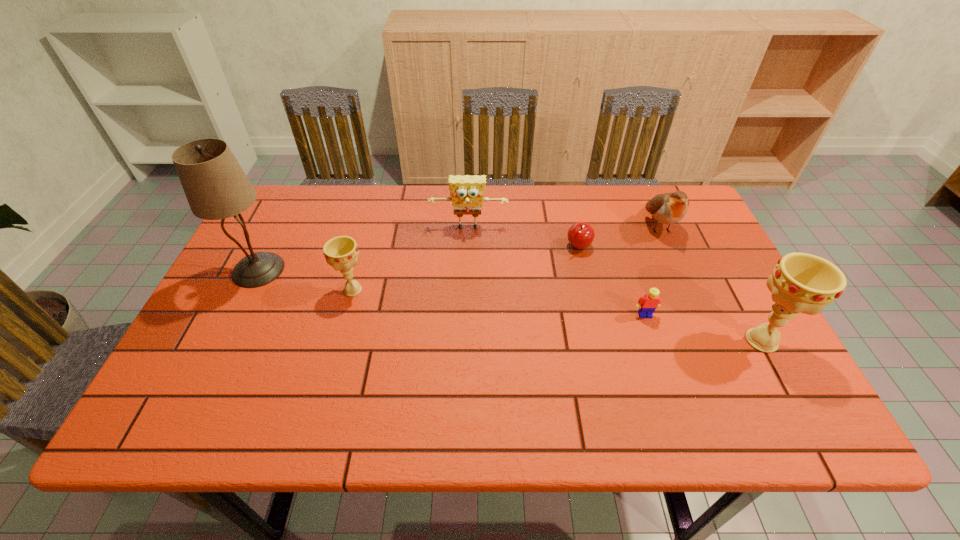
Where is `unoccupied area between the cherry and the nearest object`? unoccupied area between the cherry and the nearest object is located at coordinates (670, 293).

This screenshot has height=540, width=960. I want to click on object that can be found as the fifth closest to the fifth object from right to left, so click(x=647, y=304).

Locate which object ranks second in proximity to the sixth shortest object. Please provide its 2D coordinates. Your answer should be formatted as a tuple, i.e. [(x, y)], where the tuple contains the x and y coordinates of a point satisfying the conditions above.

[(668, 208)]

Where is `free space that satisfies the following two spatial constraints: 1. on the front-facing side of the nearer chalice; 2. on the left side of the leftmost object`? free space that satisfies the following two spatial constraints: 1. on the front-facing side of the nearer chalice; 2. on the left side of the leftmost object is located at coordinates (224, 341).

This screenshot has width=960, height=540. What are the coordinates of `free location that satisfies the following two spatial constraints: 1. at the face of the bird; 2. on the front-facing side of the leftmost object` in the screenshot? It's located at (679, 270).

The image size is (960, 540). Find the location of `vacant space that satisfies the following two spatial constraints: 1. on the face of the fifth object from right to left; 2. on the right side of the second tallest object`. vacant space that satisfies the following two spatial constraints: 1. on the face of the fifth object from right to left; 2. on the right side of the second tallest object is located at coordinates pos(466,341).